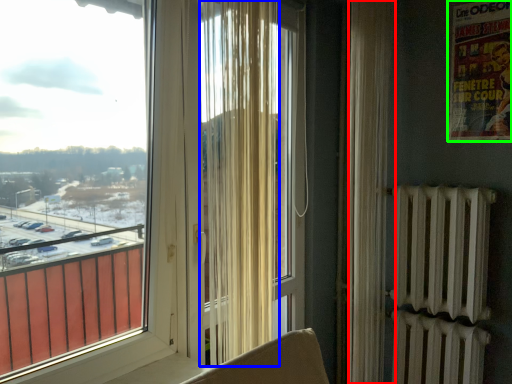
Question: Based on their relative distances, which object is farther from curtain (highlighted by a red box)? Choose from curtain (highlighted by a blue box) and poster page (highlighted by a green box).

Choices:
 (A) curtain
 (B) poster page

Answer: (A)